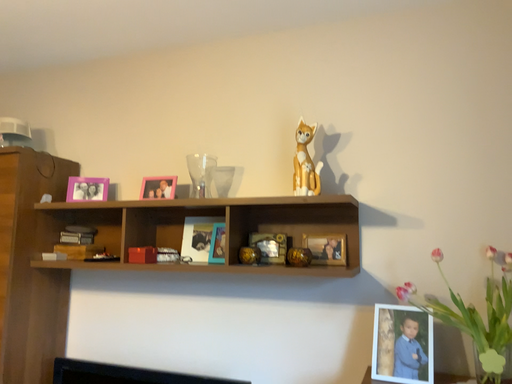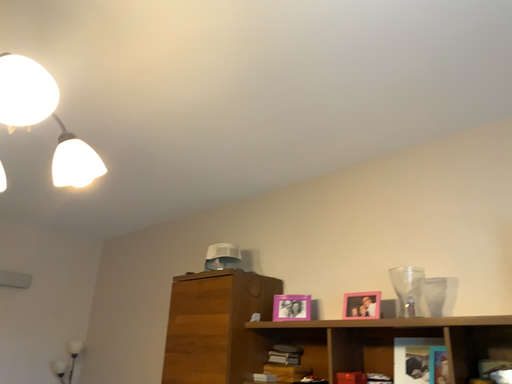
Question: Which way did the camera rotate in the video?

Choices:
 (A) rotated downward
 (B) rotated upward

Answer: (B)